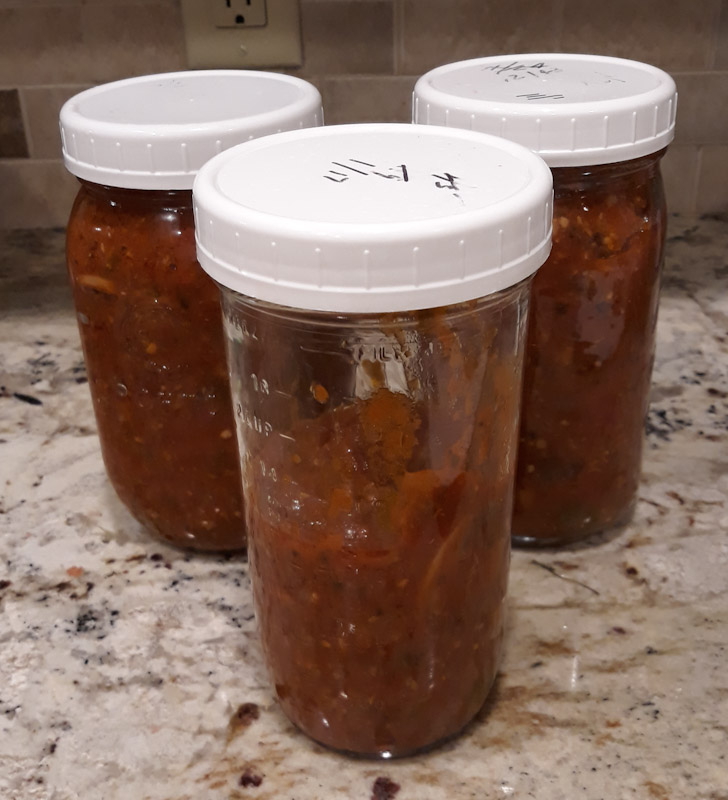
Where is `tile border`? This screenshot has width=728, height=800. tile border is located at coordinates (17, 180).